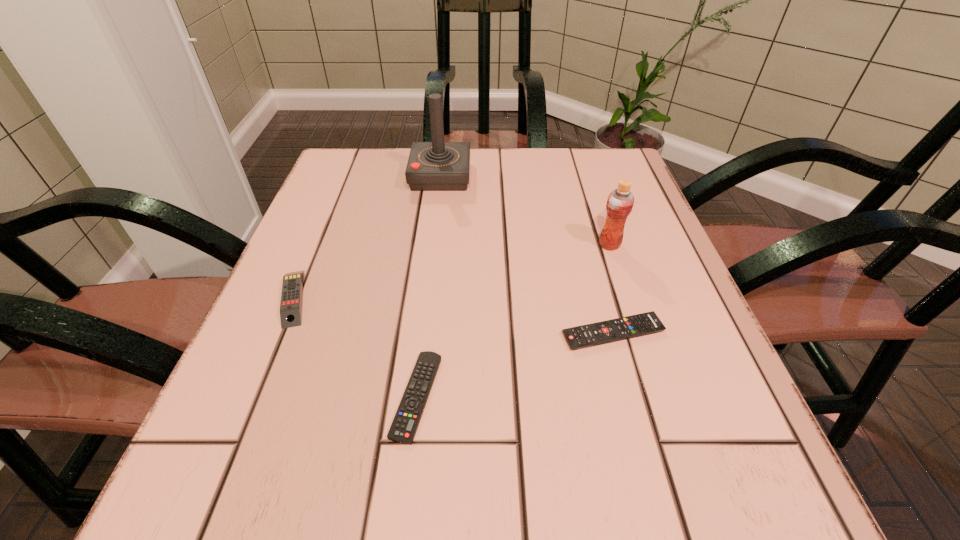
The height and width of the screenshot is (540, 960). I want to click on the farthest object, so click(x=432, y=166).

This screenshot has width=960, height=540. Identify the location of joystick. (432, 166).

At what (x,y) coordinates should I click in order to perform the action: click on the second tallest object. Please return your answer as a coordinate pair (x, y). The height and width of the screenshot is (540, 960). Looking at the image, I should click on (620, 201).

The image size is (960, 540). I want to click on orange juice, so point(620,201).

The image size is (960, 540). What are the coordinates of `the tallest remote control` in the screenshot? It's located at (291, 297).

The width and height of the screenshot is (960, 540). I want to click on the third tallest object, so click(x=291, y=297).

The width and height of the screenshot is (960, 540). I want to click on the rightmost remote control, so click(633, 326).

Find the location of `the second shortest object`. the second shortest object is located at coordinates (633, 326).

Locate an element on the screen. the nearest remote control is located at coordinates (403, 429).

At what (x,y) coordinates should I click in order to perform the action: click on the second remote control from left to right. Please return your answer as a coordinate pair (x, y). Looking at the image, I should click on (403, 429).